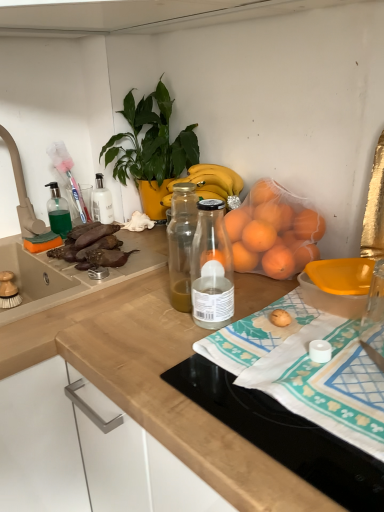
At what (x,y) coordinates should I click in order to perform the action: click on wooden at center, which is the second countertop in right-to-left order. Please return your answer as a coordinate pair (x, y). Looking at the image, I should click on click(x=79, y=305).

Describe the element at coordinates (79, 305) in the screenshot. I see `wooden at center, which is the second countertop in right-to-left order` at that location.

What do you see at coordinates (337, 285) in the screenshot? This screenshot has width=384, height=512. I see `yellow plastic bowl at lower right` at bounding box center [337, 285].

Where is `green glossy plant at upper center`? The width and height of the screenshot is (384, 512). green glossy plant at upper center is located at coordinates (151, 149).

Find the location of `brown matte eggplant at left`. brown matte eggplant at left is located at coordinates (92, 247).

What do you see at coordinates (92, 247) in the screenshot? I see `brown matte eggplant at left` at bounding box center [92, 247].

The image size is (384, 512). Describe the element at coordinates (22, 192) in the screenshot. I see `green plastic faucet at upper left` at that location.

This screenshot has height=512, width=384. Identify the location of green translucent soap dispenser at left. (58, 212).

This screenshot has width=384, height=512. In order to click on wooden at center, which is the second countertop in right-to-left order in this screenshot , I will do `click(79, 305)`.

Which is less distant, (72, 239) or (374, 499)?

Positioned in front is point (374, 499).

Is brown matte eggplant at left outside of wooden at upper right, positioned as the second countertop in left-to-right order?

Indeed, brown matte eggplant at left is completely outside wooden at upper right, positioned as the second countertop in left-to-right order.

How many degrees apart are the facing directions of brown matte eggplant at left and wooden at upper right, positioned as the second countertop in left-to-right order?

The angular difference between brown matte eggplant at left and wooden at upper right, positioned as the second countertop in left-to-right order, is 89.4 degrees.

Between point (97, 351) and point (5, 129), which one is positioned in front?

The point (97, 351) is in front.

Is wooden at upper right, the 1th countertop when ordered from right to left, next to green plastic faucet at upper left and touching it?

No, wooden at upper right, the 1th countertop when ordered from right to left, is not beside green plastic faucet at upper left.

Considering their positions, is wooden at upper right, the 1th countertop when ordered from right to left, located in front of or behind green plastic faucet at upper left?

Visually, wooden at upper right, the 1th countertop when ordered from right to left, is located in front of green plastic faucet at upper left.

From the image's perspective, which one is positioned lower, wooden at upper right, the 1th countertop when ordered from right to left, or green plastic faucet at upper left?

wooden at upper right, the 1th countertop when ordered from right to left, appears lower in the image.

Measure the distance between green plastic faucet at upper left and white cotton towel at center.

They are 33.17 inches apart.

Is point (31, 223) closer to viewer compared to point (378, 368)?

No, (31, 223) is behind (378, 368).

Which object is closer to the camera taking this photo, green plastic faucet at upper left or white cotton towel at center?

white cotton towel at center is in front.

Considering the sizes of objects wooden at center, which is the second countertop in right-to-left order, and yellow plastic bowl at lower right in the image provided, who is smaller, wooden at center, which is the second countertop in right-to-left order, or yellow plastic bowl at lower right?

With smaller size is yellow plastic bowl at lower right.

This screenshot has width=384, height=512. I want to click on countertop that appears behind the yellow plastic bowl at lower right, so click(79, 305).

Based on the photo, is wooden at center, the first countertop when ordered from left to right, looking in the opposite direction of yellow plastic bowl at lower right?

No, yellow plastic bowl at lower right is not at the back of wooden at center, the first countertop when ordered from left to right.

Is yellow plastic bowl at lower right inside wooden at center, which is the second countertop in right-to-left order?

Definitely not — yellow plastic bowl at lower right is not inside wooden at center, which is the second countertop in right-to-left order.

From a real-world perspective, is white cotton towel at center located higher than green glossy plant at upper center?

Incorrect, from a real-world perspective, white cotton towel at center is lower than green glossy plant at upper center.

Is white cotton towel at center oriented away from green glossy plant at upper center?

white cotton towel at center is not turned away from green glossy plant at upper center.

Measure the distance between white cotton towel at center and green glossy plant at upper center.

They are 28.43 inches apart.

Is there a large distance between white cotton towel at center and green glossy plant at upper center?

No, white cotton towel at center is not far from green glossy plant at upper center.

Does wooden at upper right, the 1th countertop when ordered from right to left, appear on the right side of brown matte eggplant at left?

Yes.

Consider the image. Does wooden at upper right, the 1th countertop when ordered from right to left, lie in front of brown matte eggplant at left?

Yes, wooden at upper right, the 1th countertop when ordered from right to left, is closer to the camera.

Looking at this image, can brown matte eggplant at left be found inside wooden at upper right, the 1th countertop when ordered from right to left?

No.

Considering the positions of point (251, 417) and point (76, 255), is point (251, 417) closer or farther from the camera than point (76, 255)?

Point (251, 417) is closer to the camera than point (76, 255).

You are a GUI agent. You are given a task and a screenshot of the screen. Output one action in this format:
    pyautogui.click(x=<x>, y=<y>)
    Task: Click on the houseplant behind the wooden at center, the first countertop when ordered from left to right
    The width and height of the screenshot is (384, 512).
    Given the screenshot: What is the action you would take?
    pyautogui.click(x=151, y=149)

In the scene shown: Is green glossy plant at upper center facing towards wooden at center, the first countertop when ordered from left to right?

Yes, green glossy plant at upper center is aimed at wooden at center, the first countertop when ordered from left to right.

In the image, is green glossy plant at upper center on the left side or the right side of wooden at center, which is the second countertop in right-to-left order?

green glossy plant at upper center is to the right of wooden at center, which is the second countertop in right-to-left order.

Is wooden at center, which is the second countertop in right-to-left order, located within green glossy plant at upper center?

No.

From the image's perspective, count 2nd countertops downward from the brown matte eggplant at left and point to it. Please provide its 2D coordinates.

[(216, 408)]

What are the coordinates of `faucet above the wooden at upper right, the 1th countertop when ordered from right to left (from the image's perspective)` in the screenshot? It's located at (22, 192).

Based on their spatial positions, is brown matte eggplant at left or yellow plastic bowl at lower right further from green plastic faucet at upper left?

yellow plastic bowl at lower right lies further to green plastic faucet at upper left than the other object.

From the picture: Which object lies further to the anchor point wooden at upper right, positioned as the second countertop in left-to-right order, white cotton towel at center or green plastic faucet at upper left?

green plastic faucet at upper left is further to wooden at upper right, positioned as the second countertop in left-to-right order.

Which object lies nearer to the anchor point yellow plastic bowl at lower right, green plastic faucet at upper left or wooden at upper right, positioned as the second countertop in left-to-right order?

The object closer to yellow plastic bowl at lower right is wooden at upper right, positioned as the second countertop in left-to-right order.

When comparing their distances from green glossy plant at upper center, does yellow plastic bowl at lower right or wooden at center, the first countertop when ordered from left to right, seem further?

yellow plastic bowl at lower right is positioned further to the anchor green glossy plant at upper center.

Based on their spatial positions, is brown matte eggplant at left or green translucent soap dispenser at left further from yellow plastic bowl at lower right?

Based on the image, green translucent soap dispenser at left appears to be further to yellow plastic bowl at lower right.

Based on their spatial positions, is yellow plastic bowl at lower right or green translucent soap dispenser at left further from wooden at center, which is the second countertop in right-to-left order?

yellow plastic bowl at lower right is positioned further to the anchor wooden at center, which is the second countertop in right-to-left order.

Considering their positions, is wooden at upper right, positioned as the second countertop in left-to-right order, positioned closer to wooden at center, the first countertop when ordered from left to right, than white cotton towel at center?

wooden at upper right, positioned as the second countertop in left-to-right order, is positioned closer to the anchor wooden at center, the first countertop when ordered from left to right.

Considering their positions, is wooden at center, which is the second countertop in right-to-left order, positioned closer to green glossy plant at upper center than yellow plastic bowl at lower right?

wooden at center, which is the second countertop in right-to-left order, is positioned closer to the anchor green glossy plant at upper center.

This screenshot has height=512, width=384. Identify the location of houseplant between wooden at center, the first countertop when ordered from left to right, and wooden at upper right, positioned as the second countertop in left-to-right order, from left to right. (151, 149).

In order to click on houseplant between wooden at center, the first countertop when ordered from left to right, and yellow plastic bowl at lower right, in the horizontal direction in this screenshot , I will do `click(151, 149)`.

The image size is (384, 512). What are the coordinates of `food between green plastic faucet at upper left and wooden at center, which is the second countertop in right-to-left order, in the up-down direction` in the screenshot? It's located at (92, 247).

Locate an element on the screen. The height and width of the screenshot is (512, 384). houseplant located between green translucent soap dispenser at left and yellow plastic bowl at lower right in the left-right direction is located at coordinates (151, 149).